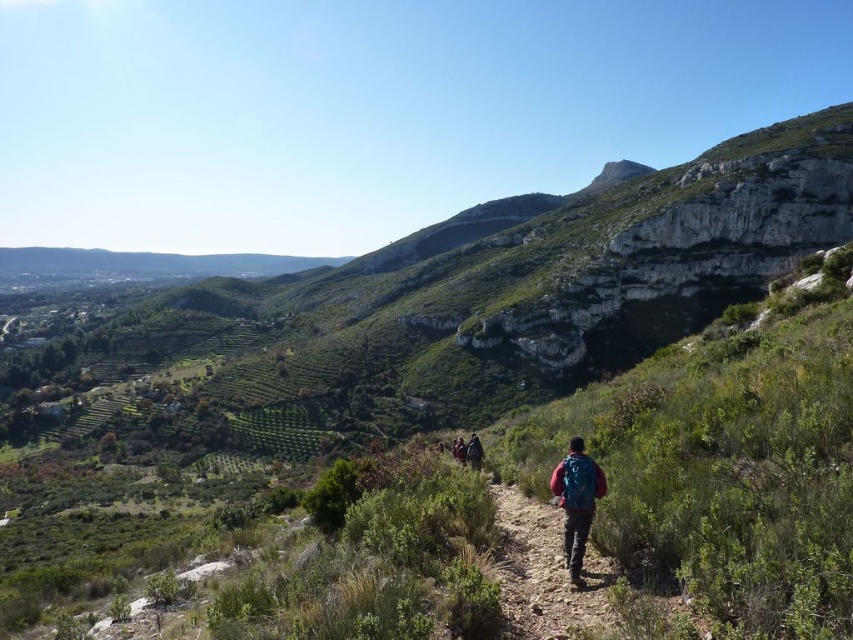
Question: Estimate the real-world distances between objects in this image. Which object is farther from the matte blue backpack at center?

Choices:
 (A) dark blue jacket at center
 (B) teal fabric backpack at center

Answer: (A)

Question: Which point is closer to the camera?

Choices:
 (A) teal fabric backpack at center
 (B) matte blue backpack at center
 (C) dark blue jacket at center

Answer: (B)

Question: Based on their relative distances, which object is nearer to the matte blue backpack at center?

Choices:
 (A) red fabric backpack at center
 (B) dark blue jacket at center
 (C) teal fabric backpack at center

Answer: (A)

Question: Is red fabric backpack at center to the left of dark blue jacket at center from the viewer's perspective?

Choices:
 (A) yes
 (B) no

Answer: (B)

Question: Can you confirm if red fabric backpack at center is wider than dark blue jacket at center?

Choices:
 (A) no
 (B) yes

Answer: (A)

Question: Is red fabric backpack at center smaller than teal fabric backpack at center?

Choices:
 (A) no
 (B) yes

Answer: (B)